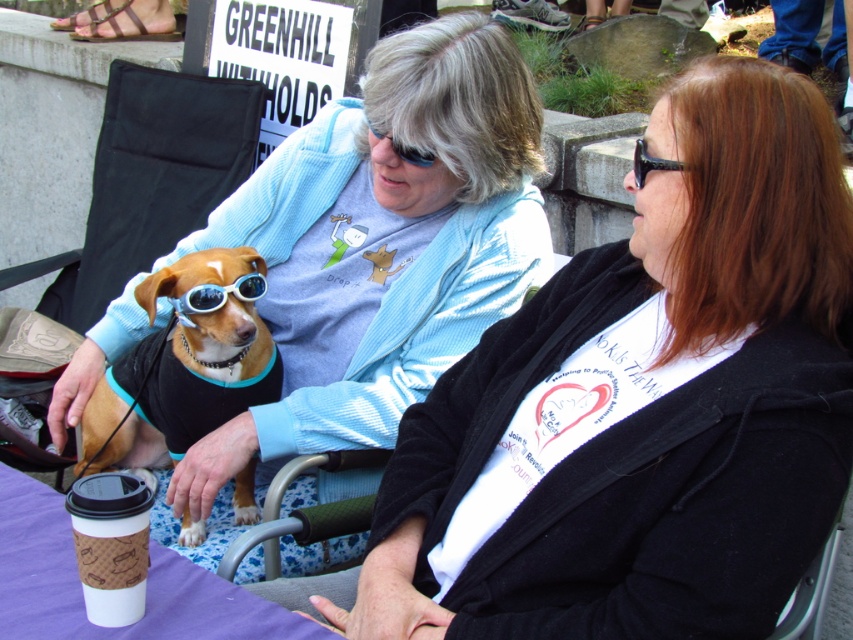
You are a photographer trying to capture a closeup of the black plastic sunglasses at upper right without including the light blue corduroy sweater at center in the frame. Is this possible given their positions?

The light blue corduroy sweater at center is much taller than the black plastic sunglasses at upper right. Since the sweater is taller, it might block the view of the sunglasses if they are positioned behind it. However, since the sunglasses are at upper right, you might be able to angle the camera to focus on the sunglasses without the sweater obstructing the shot, provided there is enough space between them.

You are standing at the point with coordinates point (183, 445) and want to move to the point with coordinates point (811, 524). Which direction should you move to reach your destination?

You should move forward because point (811, 524) is in front of point (183, 445).

You are standing in the scene and want to place a small flower pot at point (151, 380). The flower pot is 1.8 meters tall. Can you safely place it there without it hitting anyone?

The distance of point (151, 380) from viewer is 2.02 meters. Since the flower pot is 1.8 meters tall, placing it at this point would leave enough clearance between the top of the pot and the individuals in the scene, so it should be safe to place the flower pot there.